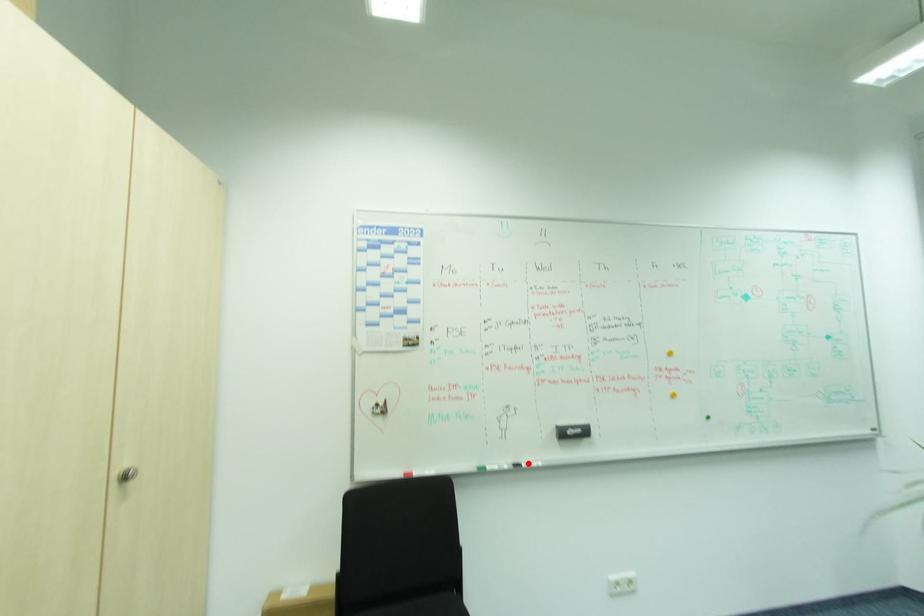
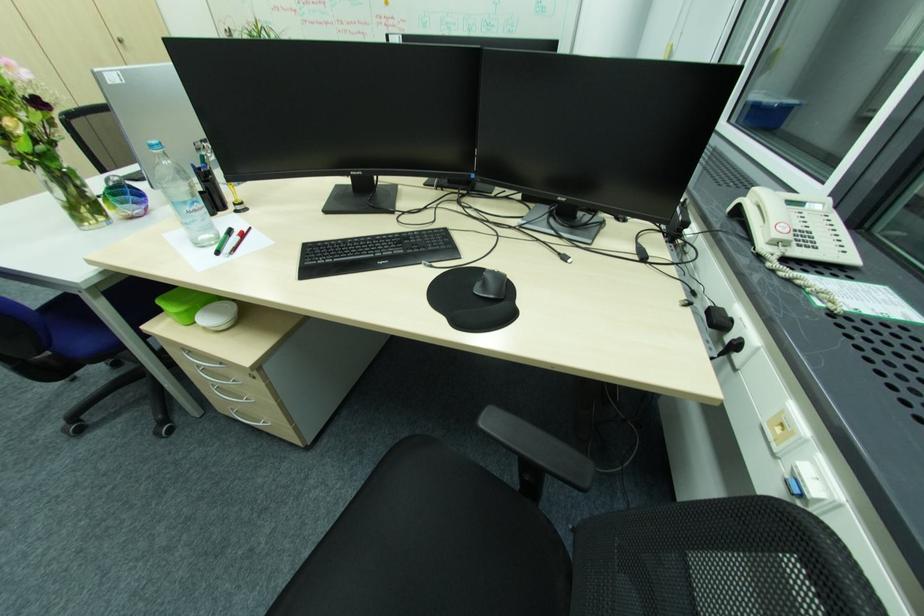
Question: I am providing you with two images of the same scene from different viewpoints. A red point is marked on the first image. Can you still see the location of the red point in image 2?

Choices:
 (A) Yes
 (B) No

Answer: (B)